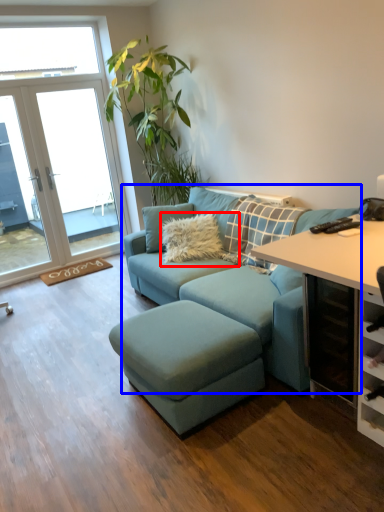
Question: Among these objects, which one is farthest to the camera, pillow (highlighted by a red box) or studio couch (highlighted by a blue box)?

Choices:
 (A) pillow
 (B) studio couch

Answer: (A)